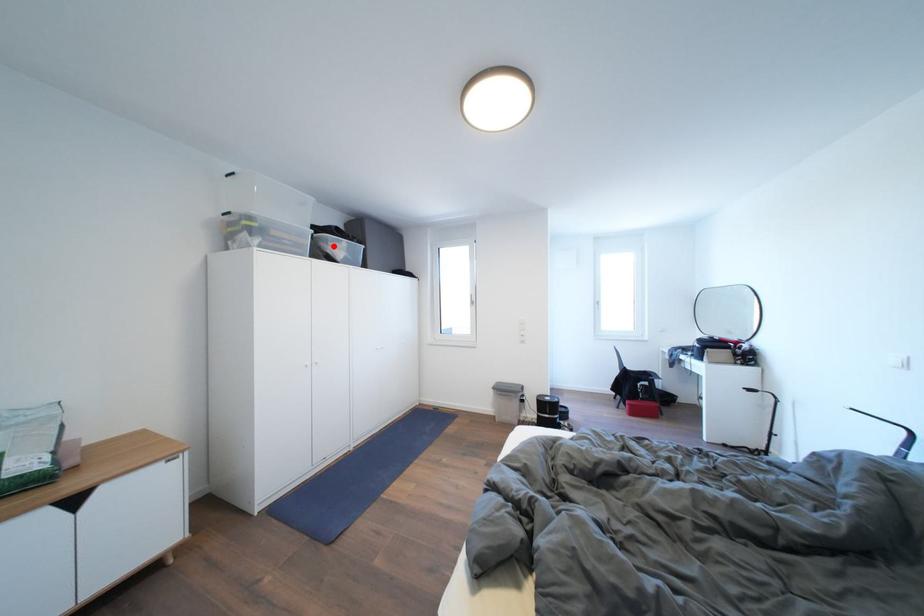
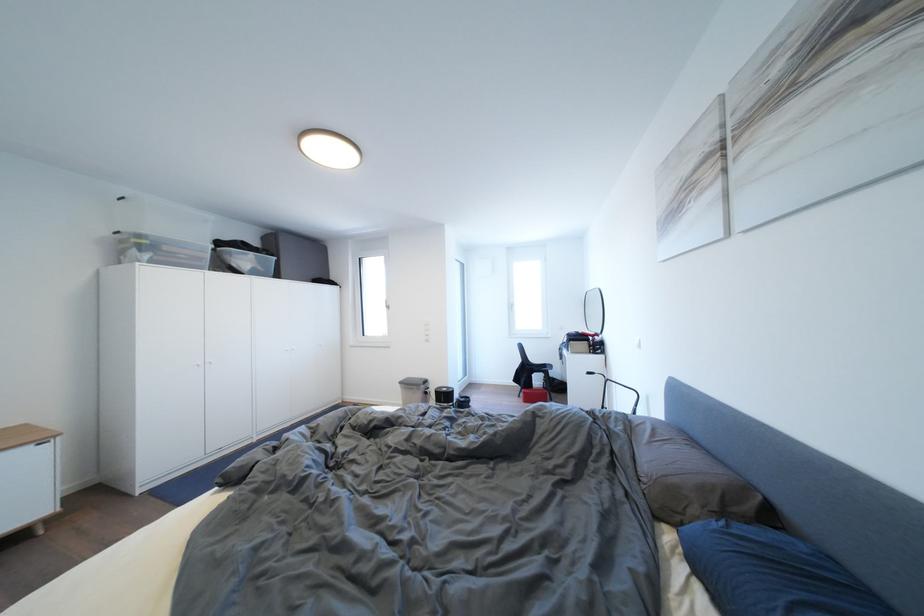
Find the pixel in the second image that matches the highlighted location in the first image.

(237, 259)